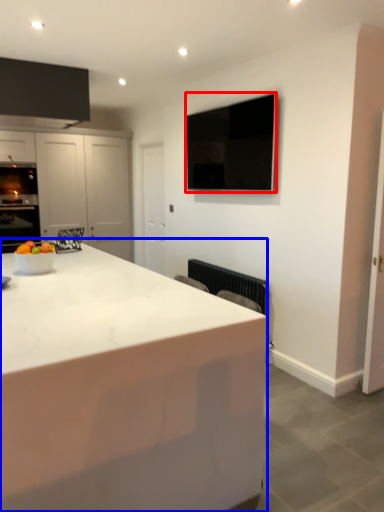
Question: Which object is further to the camera taking this photo, appliance (highlighted by a red box) or countertop (highlighted by a blue box)?

Choices:
 (A) appliance
 (B) countertop

Answer: (A)